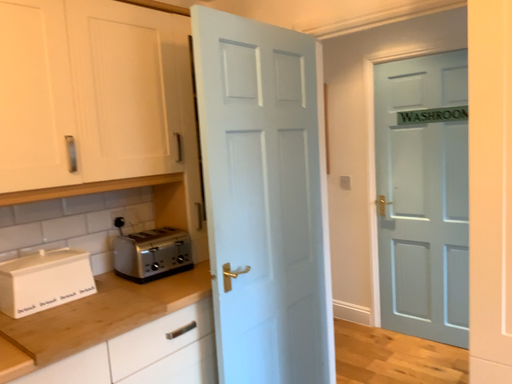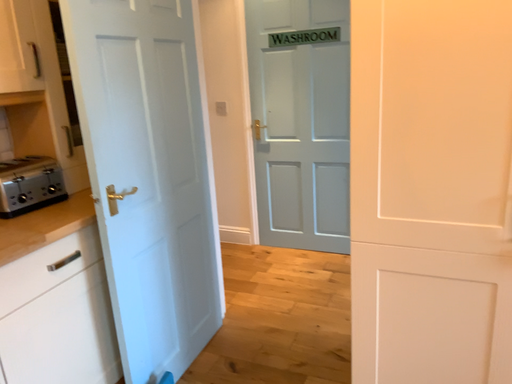
Question: How did the camera likely rotate when shooting the video?

Choices:
 (A) rotated upward
 (B) rotated downward

Answer: (B)